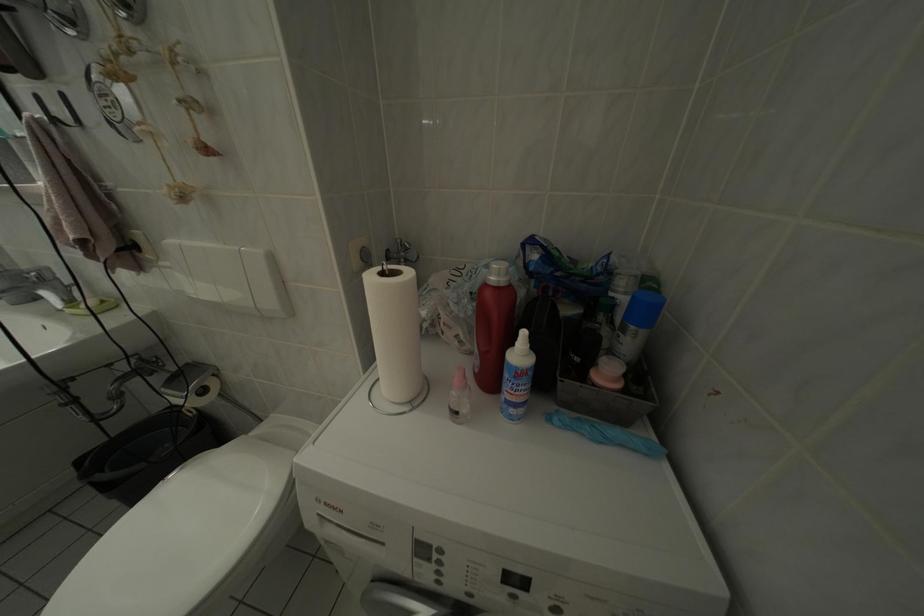
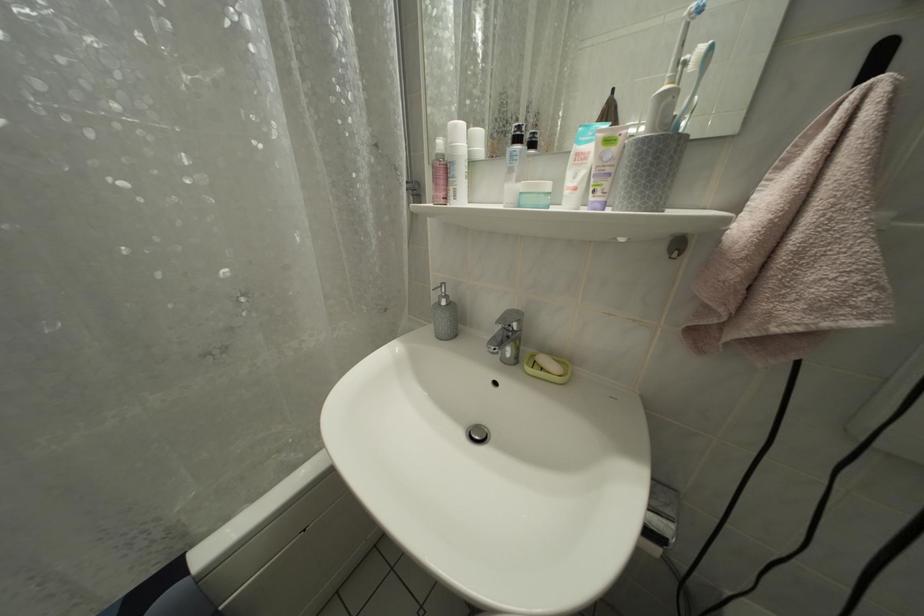
Question: What movement of the cameraman would produce the second image?

Choices:
 (A) Left
 (B) Right
 (C) Forward
 (D) Backward

Answer: (A)